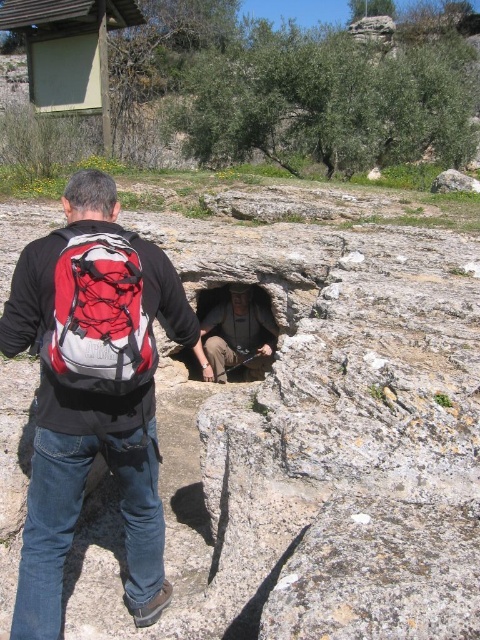
You are standing at the point labeled point (249,332) and want to move to the point labeled point (468,180). Given that you can only move forward in a straight line, will you be able to reach the second point without changing direction?

Since point (249,332) is closer to the viewer than point (468,180), moving forward in a straight line from point (249,332) would take you away from point (468,180). Therefore, you cannot reach the second point without changing direction.

You are a photographer trying to capture a clear shot of the red backpack at center. You are holding your camera at the same height as the backpack. What is the minimum distance you need to move forward or backward to ensure the backpack fills the frame properly?

The red backpack at center and camera are 2.64 meters apart from each other. To ensure the backpack fills the frame properly, you should position yourself exactly 2.64 meters away from the red backpack at center.

You are standing at the entrance of the scene and want to reach both the rough stone hole at center and the smooth gray rock at center. Which object should you approach first based on their positions?

You should approach the rough stone hole at center first because it is closer to the viewer than the smooth gray rock at center.